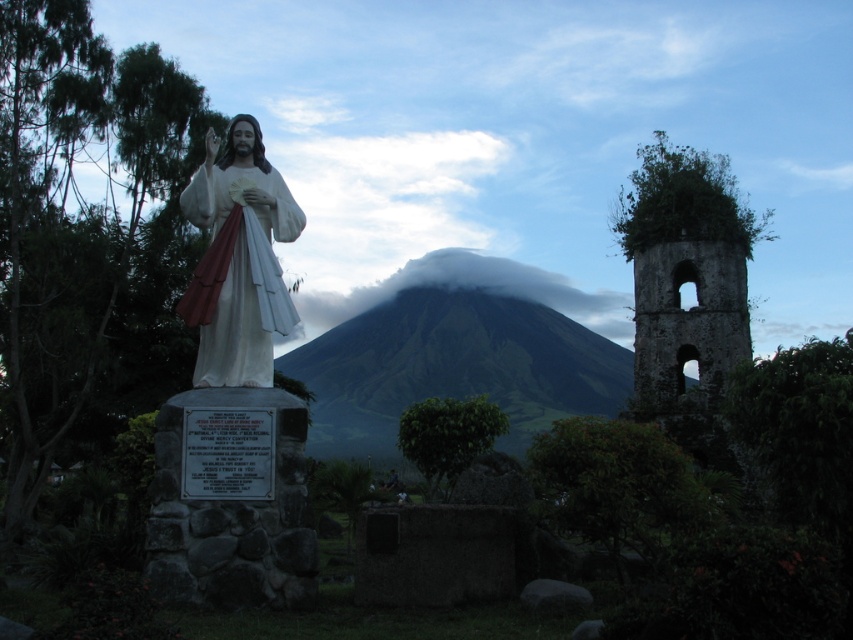
Question: Does white glossy statue at center appear on the left side of white fluffy cloud at center?

Choices:
 (A) yes
 (B) no

Answer: (A)

Question: Which point is closer to the camera?

Choices:
 (A) green grassy mountain at center
 (B) white fluffy cloud at center

Answer: (A)

Question: Does green grassy mountain at center have a greater width compared to white glossy statue at center?

Choices:
 (A) no
 (B) yes

Answer: (B)

Question: Does white glossy statue at center have a greater width compared to white fluffy cloud at center?

Choices:
 (A) yes
 (B) no

Answer: (B)

Question: Which object is positioned closest to the white fluffy cloud at center?

Choices:
 (A) white glossy statue at center
 (B) green grassy mountain at center

Answer: (B)

Question: Estimate the real-world distances between objects in this image. Which object is closer to the white fluffy cloud at center?

Choices:
 (A) white glossy statue at center
 (B) green grassy mountain at center

Answer: (B)